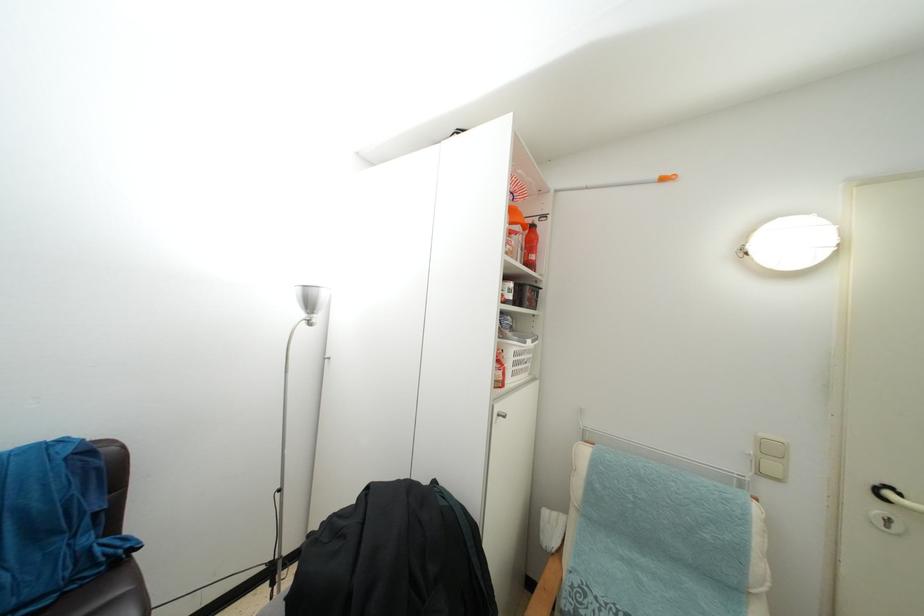
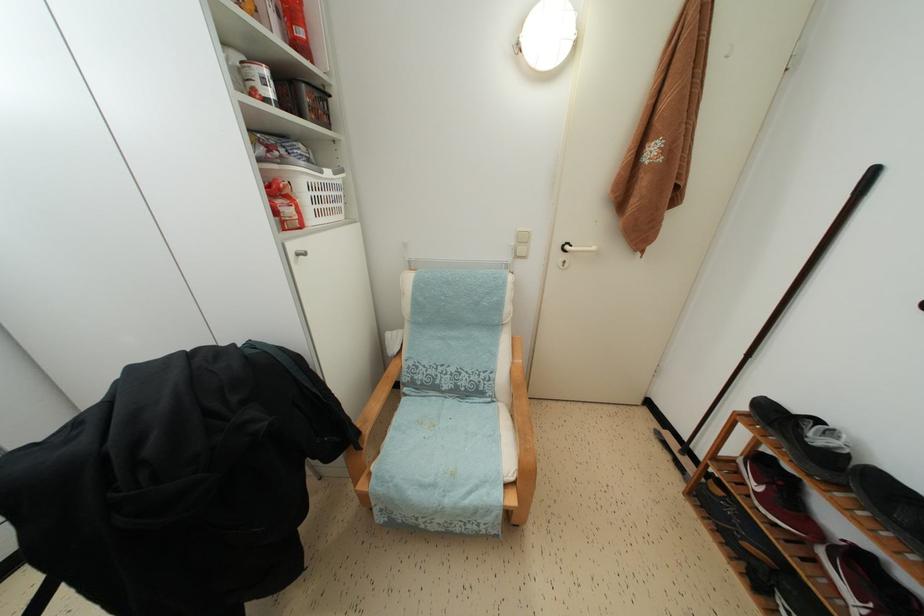
Locate, in the second image, the point that corresponds to the point at 775,456 in the first image.

(527, 245)